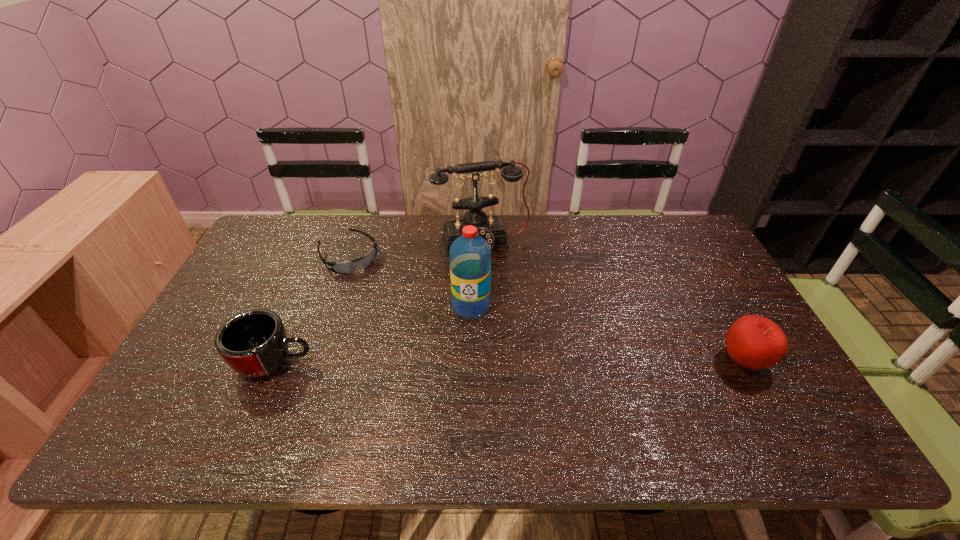
Identify the location of vacant spot on the desktop that is between the mug and the apple and is positioned on the front label of the water bottle. (448, 362).

Where is `free spot on the desktop that is between the mug and the rightmost object and is positioned on the lenses of the shortest object`? This screenshot has width=960, height=540. free spot on the desktop that is between the mug and the rightmost object and is positioned on the lenses of the shortest object is located at coordinates (445, 362).

You are a GUI agent. You are given a task and a screenshot of the screen. Output one action in this format:
    pyautogui.click(x=<x>, y=<y>)
    Task: Click on the vacant space on the desktop that is between the mug and the apple and is positioned on the dial of the telephone
    Image resolution: width=960 pixels, height=540 pixels.
    Given the screenshot: What is the action you would take?
    pyautogui.click(x=523, y=361)